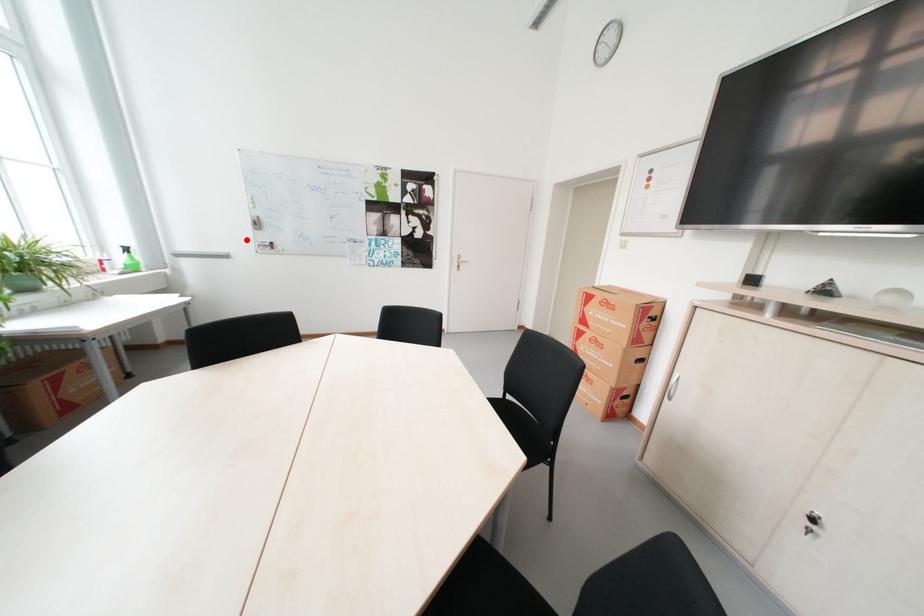
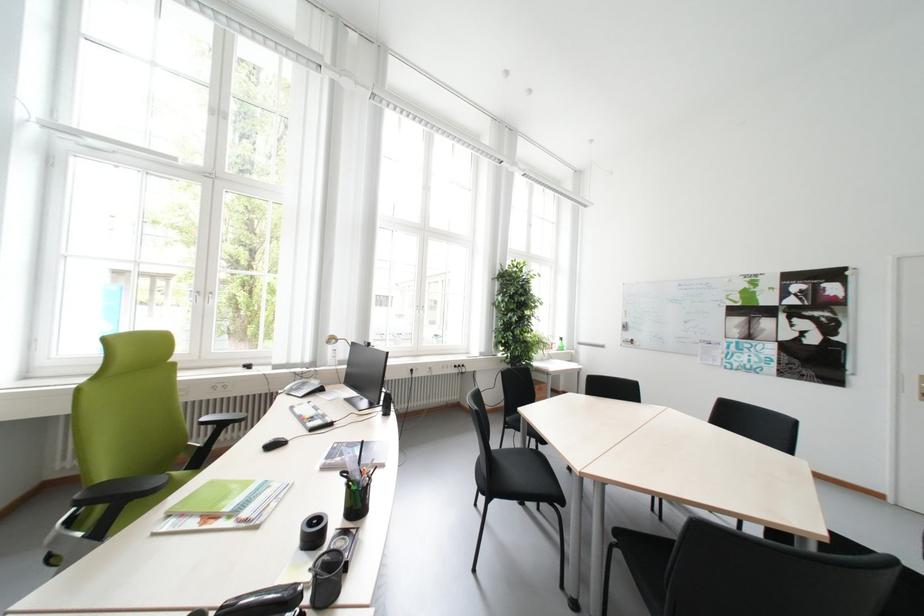
Question: I am providing you with two images of the same scene from different viewpoints. A red point is marked on the first image. At the location where the point appears in image 1, is it still visible in image 2?

Choices:
 (A) Yes
 (B) No

Answer: (A)